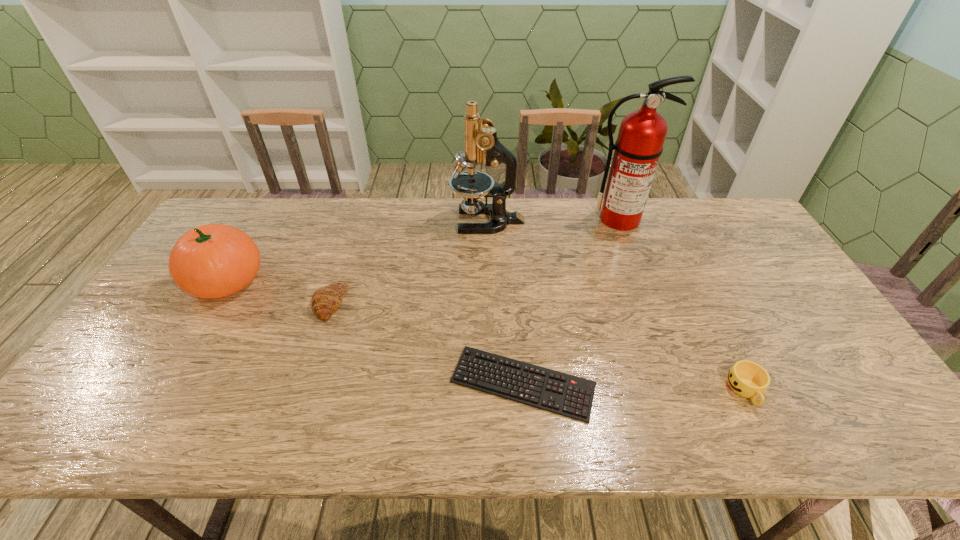
Locate an element on the screen. fire extinguisher is located at coordinates (642, 133).

Find the location of a particular element. The height and width of the screenshot is (540, 960). microscope is located at coordinates (481, 143).

I want to click on the leftmost object, so click(x=211, y=261).

Where is `the fourth shortest object`? The image size is (960, 540). the fourth shortest object is located at coordinates (211, 261).

Where is `the fifth object from right to left`? the fifth object from right to left is located at coordinates (326, 300).

You are a GUI agent. You are given a task and a screenshot of the screen. Output one action in this format:
    pyautogui.click(x=<x>, y=<y>)
    Task: Click on the cup
    This screenshot has height=540, width=960.
    Given the screenshot: What is the action you would take?
    pyautogui.click(x=748, y=379)

I want to click on the shortest object, so click(564, 394).

You are a GUI agent. You are given a task and a screenshot of the screen. Output one action in this format:
    pyautogui.click(x=<x>, y=<y>)
    Task: Click on the free space located at the nozzle of the fire extinguisher
    The height and width of the screenshot is (540, 960).
    Given the screenshot: What is the action you would take?
    pyautogui.click(x=642, y=279)

Where is `free location located 0.050m at the eyepiece of the microscope`? This screenshot has height=540, width=960. free location located 0.050m at the eyepiece of the microscope is located at coordinates (436, 221).

The width and height of the screenshot is (960, 540). I want to click on free space located at the eyepiece of the microscope, so click(x=395, y=221).